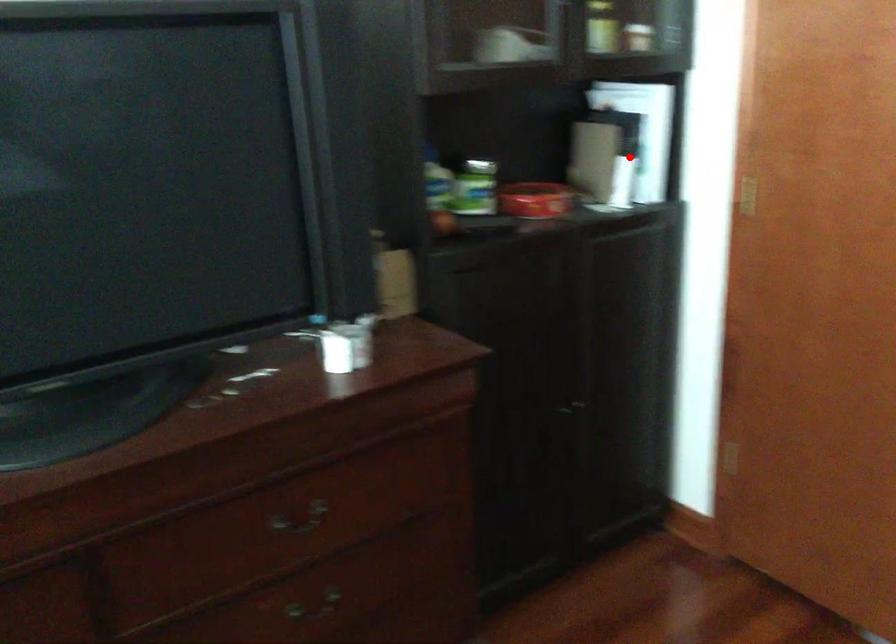
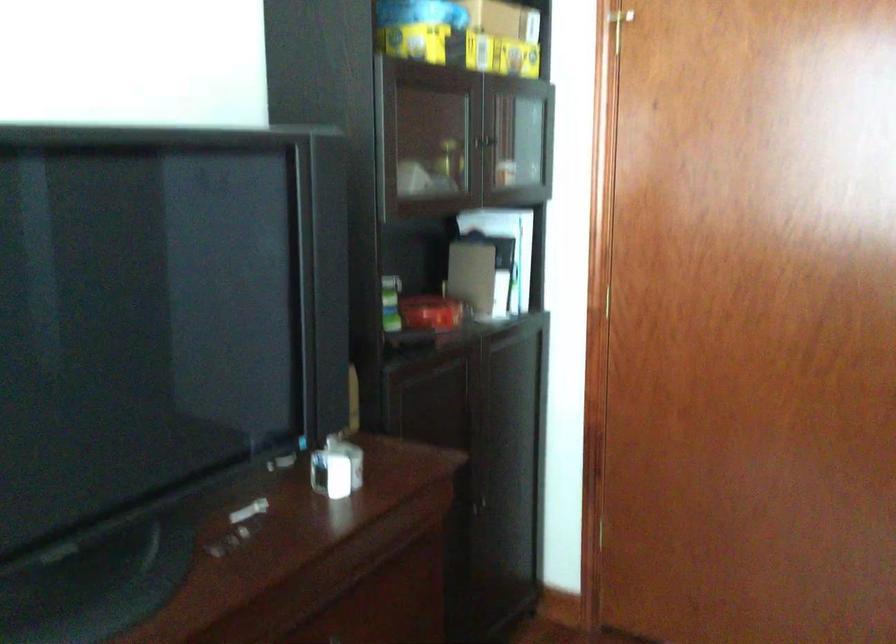
The point at the highlighted location is marked in the first image. Where is the corresponding point in the second image?

(503, 272)